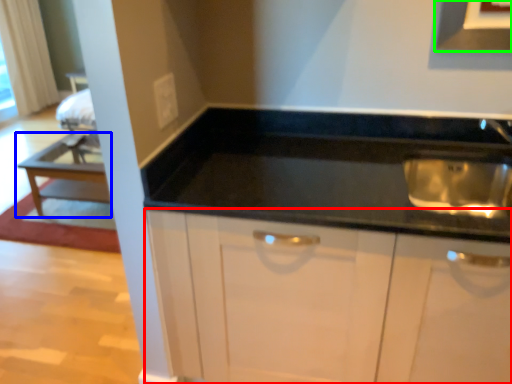
Question: Which object is positioned farthest from cabinetry (highlighted by a red box)? Select from table (highlighted by a blue box) and exhaust hood (highlighted by a green box).

Choices:
 (A) table
 (B) exhaust hood

Answer: (A)